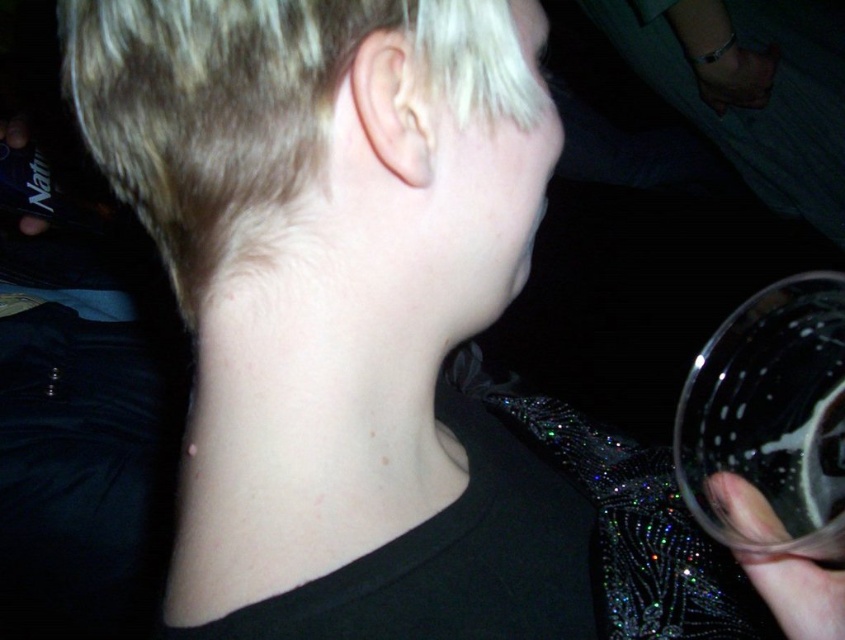
Question: Can you confirm if transparent plastic cup at lower right is thinner than translucent glass at right?

Choices:
 (A) yes
 (B) no

Answer: (B)

Question: Which of the following is the farthest from the observer?

Choices:
 (A) transparent plastic cup at lower right
 (B) translucent glass at right

Answer: (B)

Question: Which of the following is the farthest from the observer?

Choices:
 (A) (789, 284)
 (B) (767, 566)

Answer: (A)

Question: Can you confirm if transparent plastic cup at lower right is positioned to the left of translucent glass at right?

Choices:
 (A) no
 (B) yes

Answer: (A)

Question: Is transparent plastic cup at lower right below translucent glass at right?

Choices:
 (A) no
 (B) yes

Answer: (A)